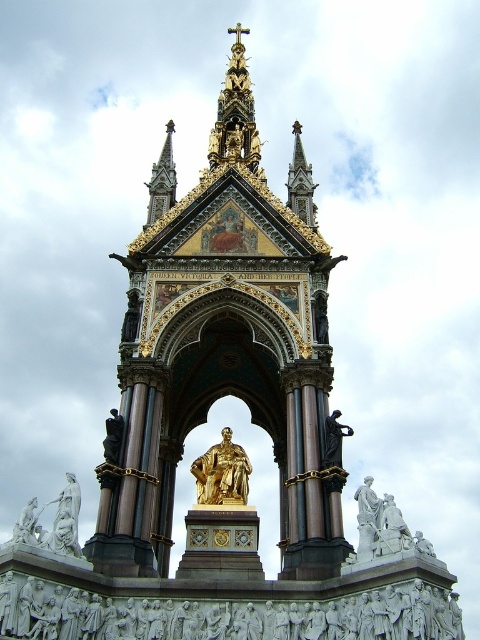
You are a tour guide explaining the Albert Memorial to visitors. You mention both the gold polished statue at center and the white marble statue at lower left. Which statue is shorter in height?

The gold polished statue at center is shorter than the white marble statue at lower left.